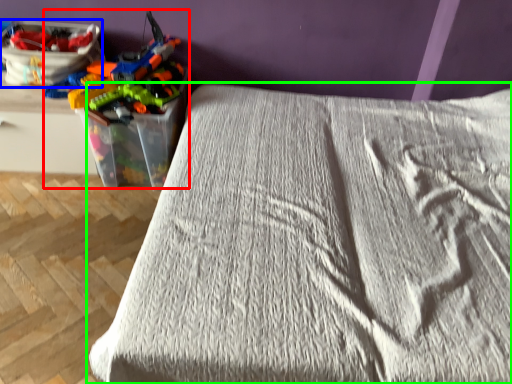
Question: Which object is positioned closest to toy (highlighted by a red box)? Select from equipment (highlighted by a blue box) and bed (highlighted by a green box).

Choices:
 (A) equipment
 (B) bed

Answer: (A)